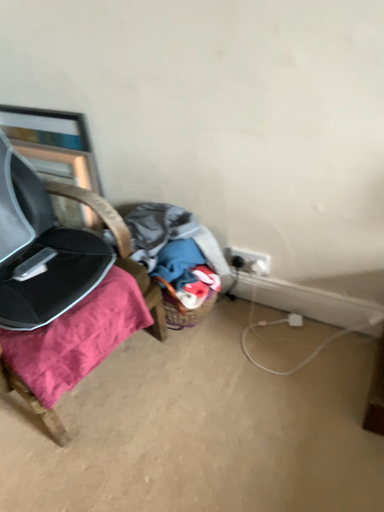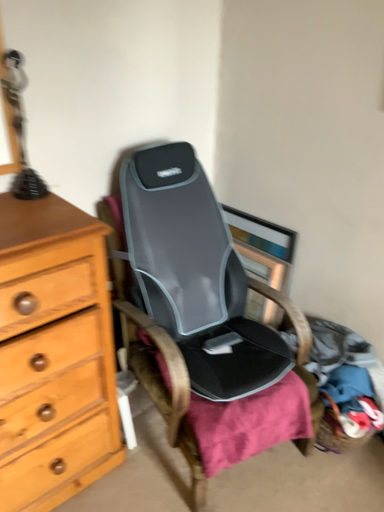
Question: Which way did the camera rotate in the video?

Choices:
 (A) rotated upward
 (B) rotated downward

Answer: (A)